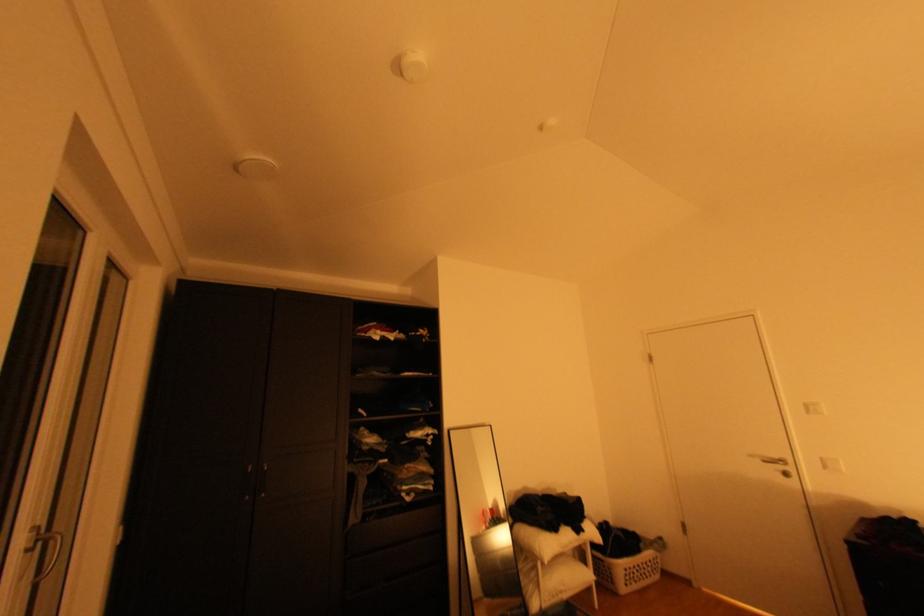
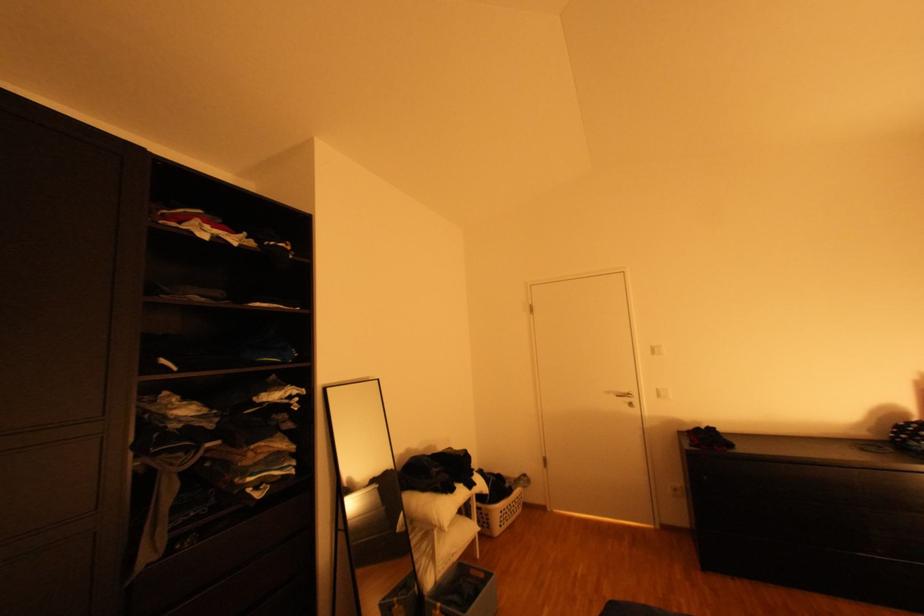
In the second image, find the point that corresponds to the point at 642,573 in the first image.

(516, 513)